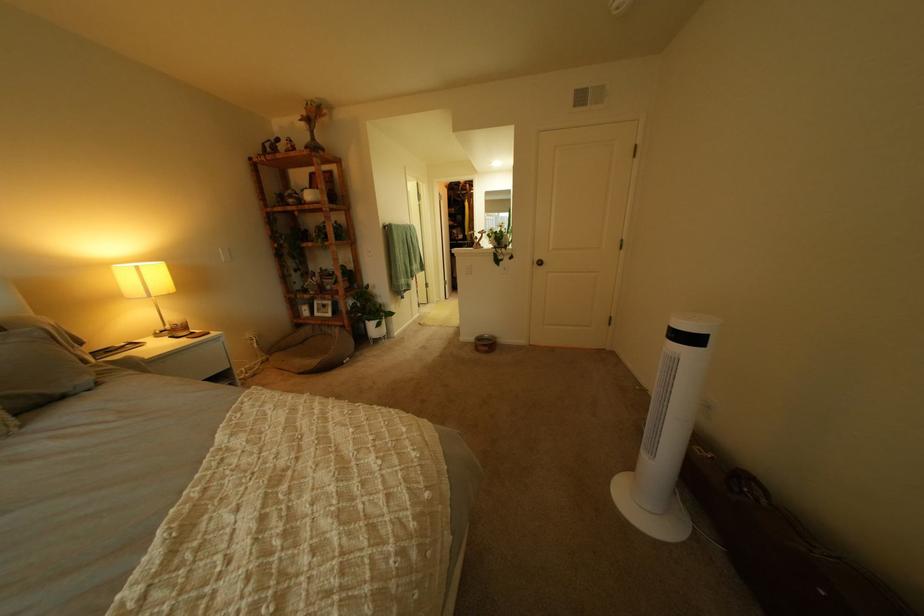
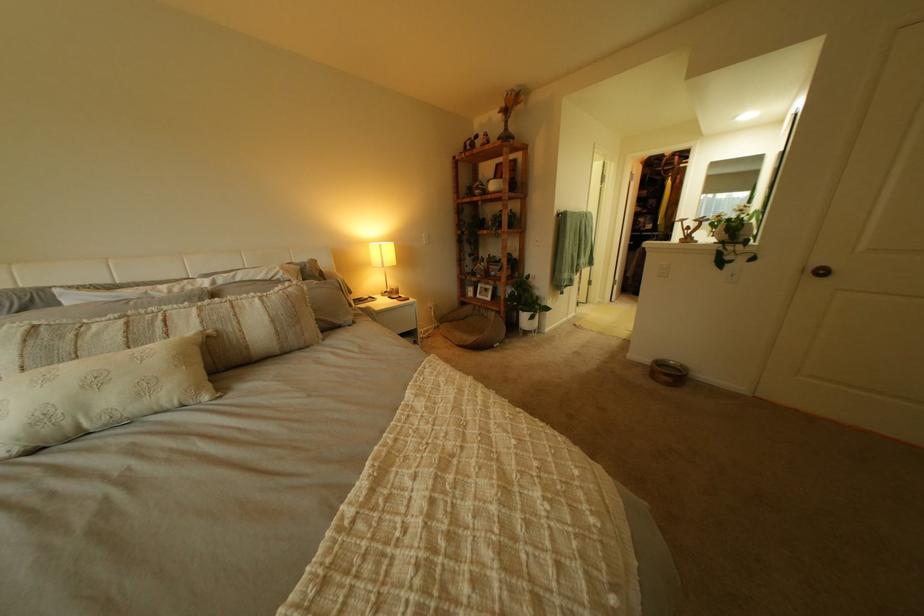
Find the pixel in the second image that matches [362,328] in the first image.

(517, 314)